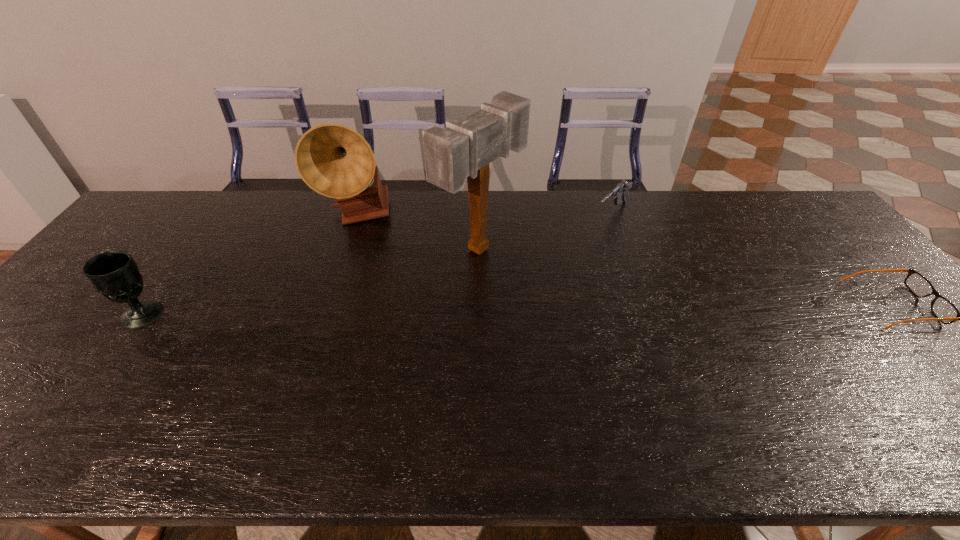
Identify the location of gun positioned at the far edge. The image size is (960, 540). (620, 191).

I want to click on phonograph record present at the far edge, so click(x=335, y=161).

This screenshot has height=540, width=960. I want to click on object that is at the right edge, so click(x=945, y=311).

In the image, there is a desktop. At what (x,y) coordinates should I click in order to perform the action: click on vacant space at the far edge. Please return your answer as a coordinate pair (x, y). Image resolution: width=960 pixels, height=540 pixels. Looking at the image, I should click on (239, 232).

This screenshot has height=540, width=960. What are the coordinates of `vacant space at the near edge of the desktop` in the screenshot? It's located at (516, 389).

Where is `vacant space at the right edge of the desktop`? vacant space at the right edge of the desktop is located at coordinates (845, 247).

The height and width of the screenshot is (540, 960). Find the location of `free region at the far left corner`. free region at the far left corner is located at coordinates (128, 231).

Where is `free spot between the spectacles and the chalice`? This screenshot has height=540, width=960. free spot between the spectacles and the chalice is located at coordinates (518, 309).

This screenshot has height=540, width=960. Identify the location of vacant area that lies between the third object from right to left and the gun. (546, 231).

Identify the location of unoccupied area between the chalice and the phonograph record. (252, 266).